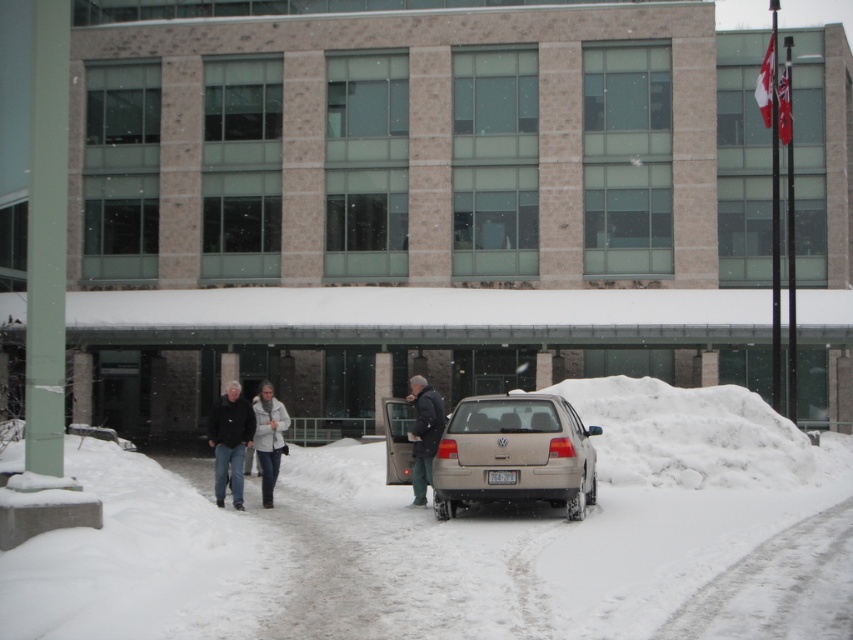
Question: Does white fluffy snow at center have a larger size compared to dark blue jeans at center?

Choices:
 (A) yes
 (B) no

Answer: (A)

Question: Which point is farther to the camera?

Choices:
 (A) white fluffy snow at center
 (B) dark blue jacket at center

Answer: (B)

Question: Can you confirm if white fluffy snow at center is positioned to the left of white fleece jacket at center?

Choices:
 (A) yes
 (B) no

Answer: (B)

Question: Which of the following is the farthest from the observer?

Choices:
 (A) (422, 476)
 (B) (207, 426)
 (C) (743, 492)
 (D) (283, 444)

Answer: (C)

Question: Which point is farther to the camera?

Choices:
 (A) (422, 444)
 (B) (555, 451)
 (C) (608, 444)

Answer: (C)

Question: Does dark blue jeans at center appear on the right side of white fleece jacket at center?

Choices:
 (A) no
 (B) yes

Answer: (B)